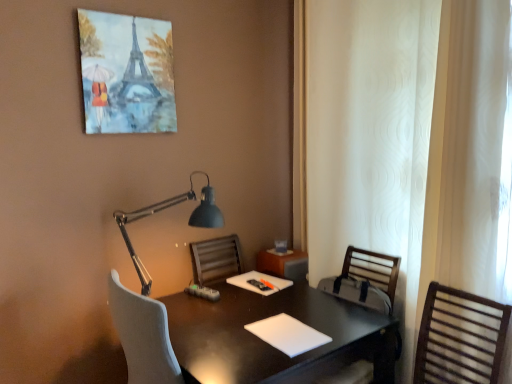
I want to click on free space to the right of white matte notepad at center, the 1th notepad from the top, so pos(308,291).